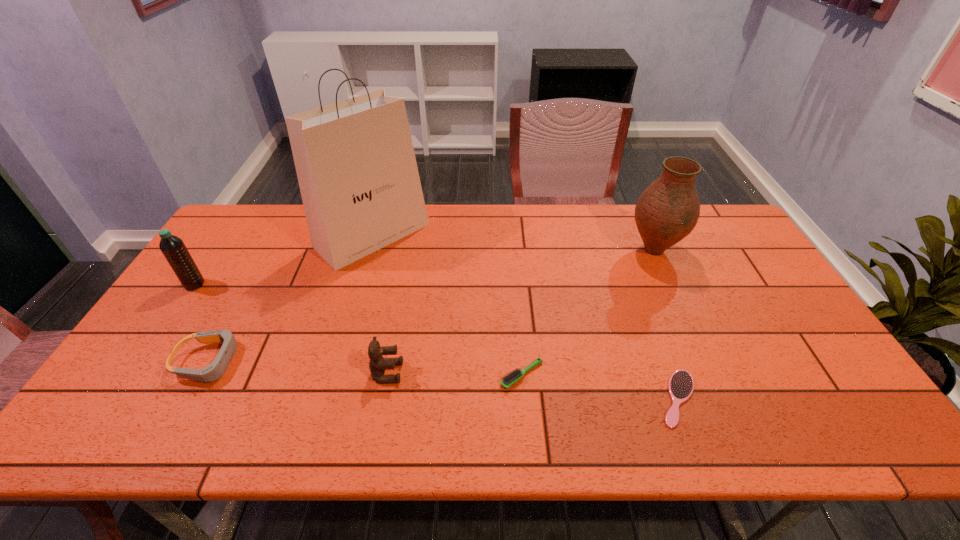
Where is `shopping bag`? Image resolution: width=960 pixels, height=540 pixels. shopping bag is located at coordinates (355, 162).

This screenshot has height=540, width=960. Find the location of `the sixth shortest object`. the sixth shortest object is located at coordinates (667, 211).

Where is `the leftmost object`? the leftmost object is located at coordinates (173, 248).

What are the coordinates of `the fifth nearest object` in the screenshot? It's located at (173, 248).

Locate an element on the screen. The width and height of the screenshot is (960, 540). teddy bear is located at coordinates (377, 364).

Image resolution: width=960 pixels, height=540 pixels. Find the location of `the second object from left to right`. the second object from left to right is located at coordinates (212, 372).

This screenshot has height=540, width=960. In order to click on the third shortest object in this screenshot , I will do `click(212, 372)`.

At what (x,y) coordinates should I click in order to perform the action: click on the left hairbrush. Please return your answer as a coordinate pair (x, y). This screenshot has height=540, width=960. Looking at the image, I should click on (511, 378).

Where is `the right hairbrush`? the right hairbrush is located at coordinates (681, 383).

This screenshot has width=960, height=540. Identify the location of blank space located 0.310m on the front of the shopping bag. (339, 352).